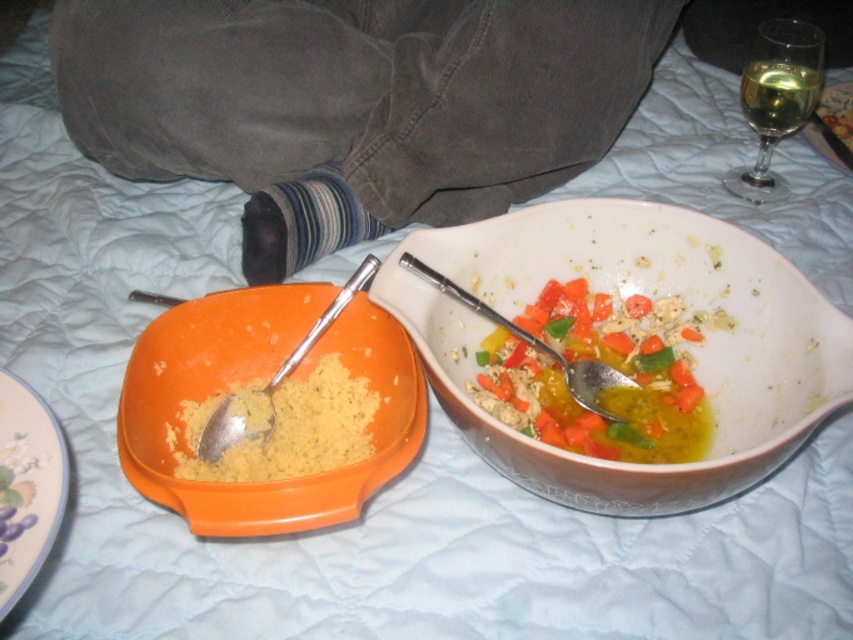
Question: Which point is farther to the camera?

Choices:
 (A) silver metallic spoon at center
 (B) multicolored vegetables at center
 (C) porcelain floral plate at lower left

Answer: (B)

Question: Can you confirm if orange matte bowl at left is thinner than gold metallic plate at upper right?

Choices:
 (A) yes
 (B) no

Answer: (B)

Question: Is yellow matte rice at lower left smaller than silver metallic spoon at center?

Choices:
 (A) no
 (B) yes

Answer: (B)

Question: Which is nearer to the transparent glass at upper right?

Choices:
 (A) porcelain floral plate at lower left
 (B) yellow matte rice at lower left

Answer: (B)

Question: Which object is the farthest from the multicolored vegetables at center?

Choices:
 (A) porcelain floral plate at lower left
 (B) orange matte bowl at left
 (C) translucent glass wine at upper right
 (D) silver metallic spoon at center

Answer: (C)

Question: Does porcelain floral plate at lower left appear on the left side of silver metallic spoon at center?

Choices:
 (A) no
 (B) yes

Answer: (B)